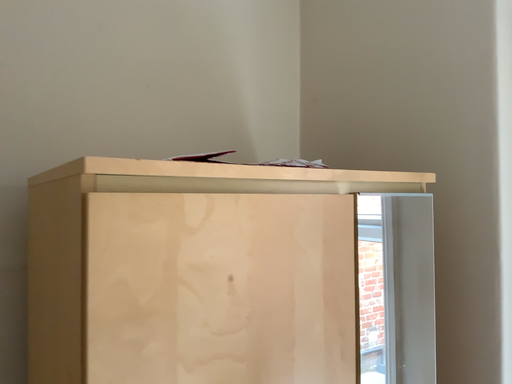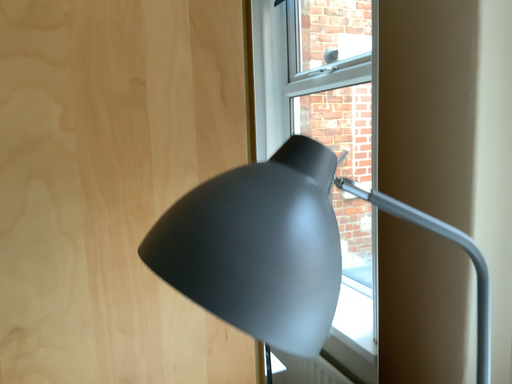
Question: How did the camera likely rotate when shooting the video?

Choices:
 (A) rotated left
 (B) rotated right

Answer: (A)